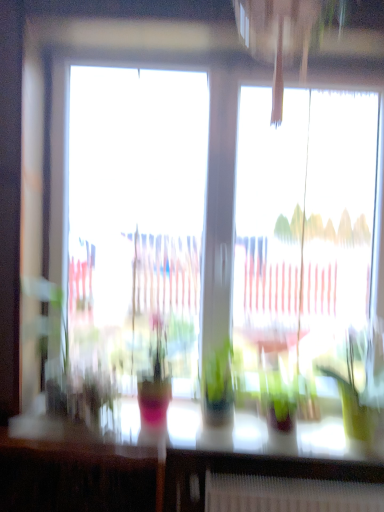
The height and width of the screenshot is (512, 384). What do you see at coordinates (357, 382) in the screenshot?
I see `green glossy houseplant at right` at bounding box center [357, 382].

What is the approximate height of transparent glass window at center?

Result: transparent glass window at center is 1.44 meters tall.

Describe the element at coordinates (218, 222) in the screenshot. Image resolution: width=384 pixels, height=512 pixels. I see `transparent glass window at center` at that location.

The image size is (384, 512). I want to click on green glossy houseplant at right, so click(x=357, y=382).

Can you confirm if transparent glass window at center is positioned to the left of translucent glass table at lower center?

No.

Is transparent glass window at center further to the viewer compared to translucent glass table at lower center?

Yes, transparent glass window at center is further from the camera.

Can you confirm if transparent glass window at center is wider than translucent glass table at lower center?

In fact, transparent glass window at center might be narrower than translucent glass table at lower center.

Between point (15, 456) and point (373, 356), which one is positioned in front?

The point (15, 456) is closer.

Is translucent glass table at lower center in contact with green glossy houseplant at right?

No, translucent glass table at lower center is not touching green glossy houseplant at right.

From the image's perspective, is translucent glass table at lower center below green glossy houseplant at right?

Yes.

Is translucent glass table at lower center taller than green glossy houseplant at right?

Incorrect, the height of translucent glass table at lower center is not larger of that of green glossy houseplant at right.

From the picture: From a real-world perspective, is green glossy houseplant at right positioned above or below transparent glass window at center?

In terms of real-world spatial position, green glossy houseplant at right is below transparent glass window at center.

From the image's perspective, between green glossy houseplant at right and transparent glass window at center, who is located below?

green glossy houseplant at right appears lower in the image.

Is point (378, 338) closer or farther from the camera than point (244, 218)?

Point (378, 338) is positioned closer to the camera compared to point (244, 218).

Is green glossy houseplant at right not within transparent glass window at center?

Yes, green glossy houseplant at right is located beyond the bounds of transparent glass window at center.

Considering the relative sizes of transparent glass window at center and green glossy houseplant at right in the image provided, is transparent glass window at center taller than green glossy houseplant at right?

Yes.

Is transparent glass window at center inside or outside of green glossy houseplant at right?

transparent glass window at center cannot be found inside green glossy houseplant at right.

In terms of size, does transparent glass window at center appear bigger or smaller than green glossy houseplant at right?

transparent glass window at center is bigger than green glossy houseplant at right.

Is transparent glass window at center looking in the opposite direction of green glossy houseplant at right?

Yes, transparent glass window at center is positioned with its back facing green glossy houseplant at right.

How much distance is there between translucent glass table at lower center and transparent glass window at center?

translucent glass table at lower center is 72.77 centimeters from transparent glass window at center.

Based on the photo, is translucent glass table at lower center in front of or behind transparent glass window at center in the image?

Clearly, translucent glass table at lower center is in front of transparent glass window at center.

Would you say translucent glass table at lower center contains transparent glass window at center?

Actually, transparent glass window at center is outside translucent glass table at lower center.

From a real-world perspective, who is located higher, translucent glass table at lower center or transparent glass window at center?

transparent glass window at center, from a real-world perspective.

Does green glossy houseplant at right have a lesser width compared to translucent glass table at lower center?

No, green glossy houseplant at right is not thinner than translucent glass table at lower center.

Is green glossy houseplant at right oriented towards translucent glass table at lower center?

No, green glossy houseplant at right does not turn towards translucent glass table at lower center.

Looking at the image, does green glossy houseplant at right seem bigger or smaller compared to translucent glass table at lower center?

Clearly, green glossy houseplant at right is larger in size than translucent glass table at lower center.

Is green glossy houseplant at right taller or shorter than translucent glass table at lower center?

Clearly, green glossy houseplant at right is taller compared to translucent glass table at lower center.

Where is `table on the left of the transparent glass window at center`? table on the left of the transparent glass window at center is located at coordinates (160, 461).

At what (x,y) coordinates should I click in order to perform the action: click on houseplant that appears on the right of translucent glass table at lower center. Please return your answer as a coordinate pair (x, y). Looking at the image, I should click on (357, 382).

From the image, which object appears to be farther from transparent glass window at center, green glossy houseplant at right or translucent glass table at lower center?

translucent glass table at lower center is further to transparent glass window at center.

When comparing their distances from translucent glass table at lower center, does transparent glass window at center or green glossy houseplant at right seem closer?

green glossy houseplant at right lies closer to translucent glass table at lower center than the other object.

Looking at this image, looking at the image, which one is located closer to transparent glass window at center, translucent glass table at lower center or green glossy houseplant at right?

green glossy houseplant at right is closer to transparent glass window at center.

Considering their positions, is green glossy houseplant at right positioned closer to translucent glass table at lower center than transparent glass window at center?

Among the two, green glossy houseplant at right is located nearer to translucent glass table at lower center.

Which object lies nearer to the anchor point green glossy houseplant at right, transparent glass window at center or translucent glass table at lower center?

Among the two, translucent glass table at lower center is located nearer to green glossy houseplant at right.

Looking at the image, which one is located further to green glossy houseplant at right, translucent glass table at lower center or transparent glass window at center?

Among the two, transparent glass window at center is located further to green glossy houseplant at right.

The width and height of the screenshot is (384, 512). In order to click on houseplant between transparent glass window at center and translucent glass table at lower center in the up-down direction in this screenshot , I will do `click(357, 382)`.